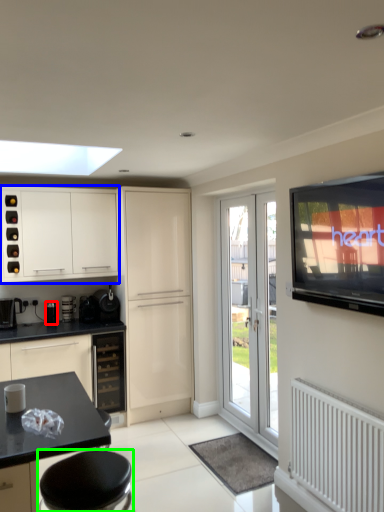
Question: Estimate the real-world distances between objects in this image. Which object is farther from appliance (highlighted by a red box), cabinetry (highlighted by a blue box) or bar stool (highlighted by a green box)?

Choices:
 (A) cabinetry
 (B) bar stool

Answer: (B)